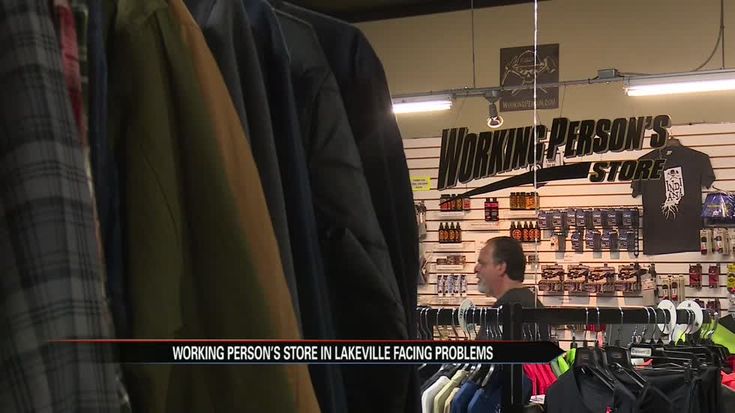
This screenshot has width=735, height=413. What are the coordinates of `white wall, blank space` in the screenshot? It's located at (614, 36).